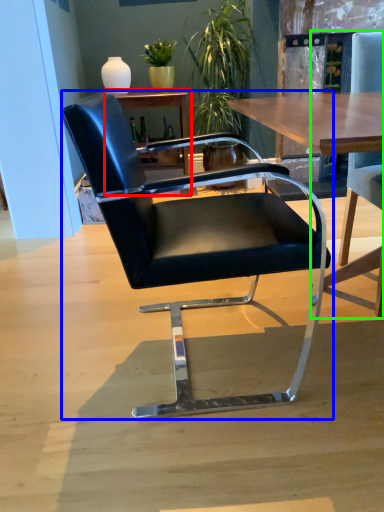
Question: Which object is the closest to the table (highlighted by a red box)? Choose among these: chair (highlighted by a blue box) or chair (highlighted by a green box).

Choices:
 (A) chair
 (B) chair

Answer: (B)